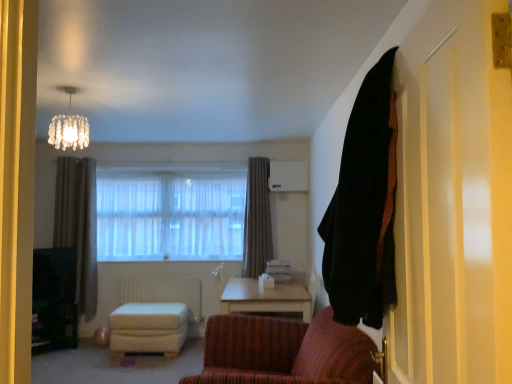
Question: Is black fabric curtain at upper right, the first curtain positioned from the right, taller than brown fabric curtain at center, the 1th curtain viewed from the back?

Choices:
 (A) yes
 (B) no

Answer: (B)

Question: Considering the relative sizes of black fabric curtain at upper right, the first curtain positioned from the right, and brown fabric curtain at center, marked as the second curtain in a left-to-right arrangement, in the image provided, is black fabric curtain at upper right, the first curtain positioned from the right, smaller than brown fabric curtain at center, marked as the second curtain in a left-to-right arrangement,?

Choices:
 (A) no
 (B) yes

Answer: (A)

Question: Would you say brown fabric curtain at center, the 1th curtain viewed from the back, is part of black fabric curtain at upper right, the 1th curtain when ordered from front to back,'s contents?

Choices:
 (A) yes
 (B) no

Answer: (B)

Question: From the image's perspective, is black fabric curtain at upper right, the third curtain positioned from the back, under brown fabric curtain at center, acting as the 2th curtain starting from the right?

Choices:
 (A) no
 (B) yes

Answer: (A)

Question: Is black fabric curtain at upper right, the third curtain positioned from the back, next to brown fabric curtain at center, acting as the 2th curtain starting from the right, and touching it?

Choices:
 (A) yes
 (B) no

Answer: (B)

Question: Is black fabric curtain at upper right, the third curtain positioned from the back, located outside brown fabric curtain at center, the 3th curtain in the front-to-back sequence?

Choices:
 (A) yes
 (B) no

Answer: (A)

Question: From the image's perspective, is white fabric stool at center located beneath black fabric curtain at upper right, which ranks as the 3th curtain in left-to-right order?

Choices:
 (A) no
 (B) yes

Answer: (B)

Question: Is white fabric stool at center not inside black fabric curtain at upper right, the third curtain positioned from the back?

Choices:
 (A) yes
 (B) no

Answer: (A)

Question: Is white fabric stool at center turned away from black fabric curtain at upper right, which ranks as the 3th curtain in left-to-right order?

Choices:
 (A) no
 (B) yes

Answer: (A)

Question: Considering the relative sizes of white fabric stool at center and black fabric curtain at upper right, the third curtain positioned from the back, in the image provided, is white fabric stool at center shorter than black fabric curtain at upper right, the third curtain positioned from the back,?

Choices:
 (A) no
 (B) yes

Answer: (B)

Question: From the image's perspective, is white fabric stool at center on black fabric curtain at upper right, which ranks as the 3th curtain in left-to-right order?

Choices:
 (A) yes
 (B) no

Answer: (B)

Question: Considering the relative sizes of white fabric stool at center and black fabric curtain at upper right, the first curtain positioned from the right, in the image provided, is white fabric stool at center taller than black fabric curtain at upper right, the first curtain positioned from the right,?

Choices:
 (A) no
 (B) yes

Answer: (A)

Question: Considering the relative sizes of dark gray textured curtain at left, marked as the second curtain in a back-to-front arrangement, and white fabric stool at center in the image provided, is dark gray textured curtain at left, marked as the second curtain in a back-to-front arrangement, shorter than white fabric stool at center?

Choices:
 (A) no
 (B) yes

Answer: (A)